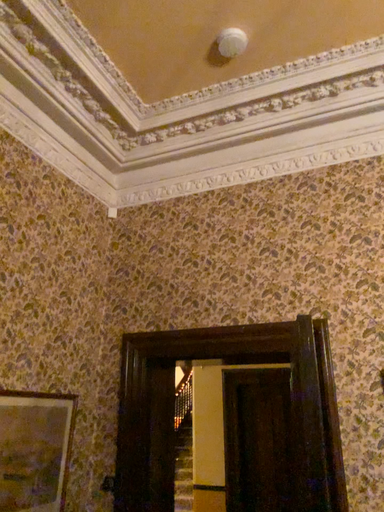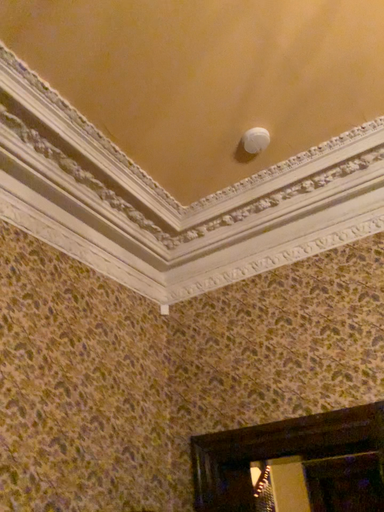
Question: Which way did the camera rotate in the video?

Choices:
 (A) rotated left
 (B) rotated right

Answer: (A)